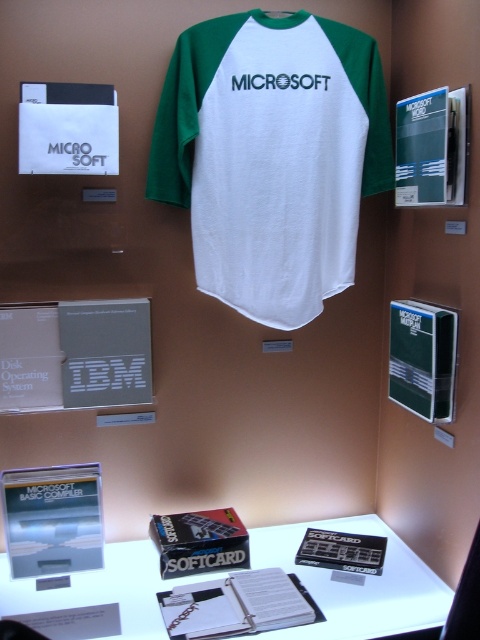
You are a tour guide standing at the camera position. You want to hand a guest a brochure that is on the white glossy table at lower center. Can you reach it without moving from your current position?

The white glossy table at lower center is 1.39 meters away from the camera, so if the tour guide can reach that distance, they might be able to hand the guest the brochure. However, typical human arm length is about 0.7 meters, so the tour guide would need to move closer to reach it.